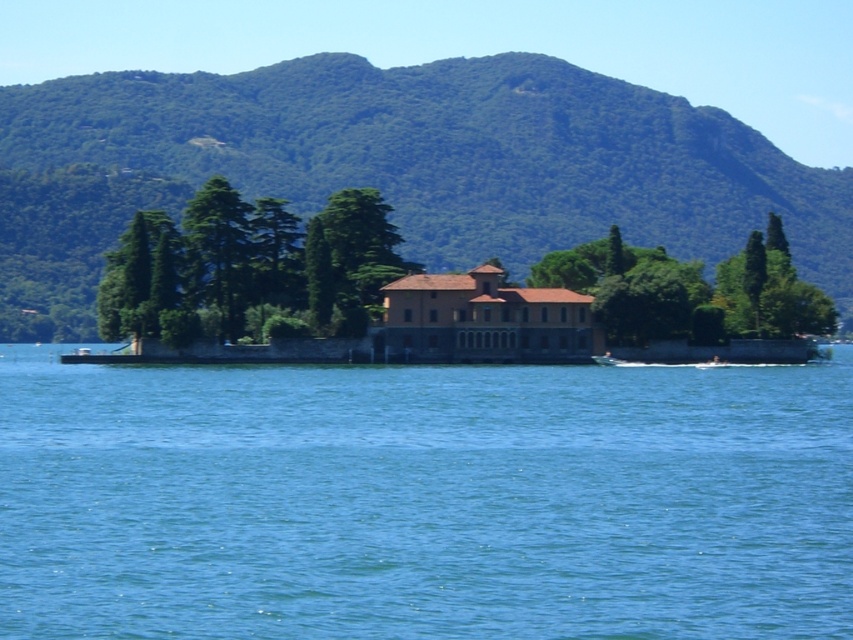
Which is above, blue water at center or green textured tree at center?

Positioned higher is green textured tree at center.

Which is below, blue water at center or green textured tree at center?

blue water at center

The height and width of the screenshot is (640, 853). What are the coordinates of `blue water at center` in the screenshot? It's located at (424, 500).

Where is `blue water at center`? The image size is (853, 640). blue water at center is located at coordinates (424, 500).

Does green leafy mountain at center have a greater height compared to green textured tree at center?

Correct, green leafy mountain at center is much taller as green textured tree at center.

Which is more to the left, green leafy mountain at center or green textured tree at center?

green textured tree at center

Is point (144, 147) closer to viewer compared to point (352, 296)?

No, it is not.

Find the location of `green leafy mountain at center`. green leafy mountain at center is located at coordinates (395, 168).

Describe the element at coordinates (424, 500) in the screenshot. The width and height of the screenshot is (853, 640). I see `blue water at center` at that location.

Between point (97, 417) and point (843, 244), which one is positioned behind?

Positioned behind is point (843, 244).

Find the location of a particular element. The width and height of the screenshot is (853, 640). blue water at center is located at coordinates (424, 500).